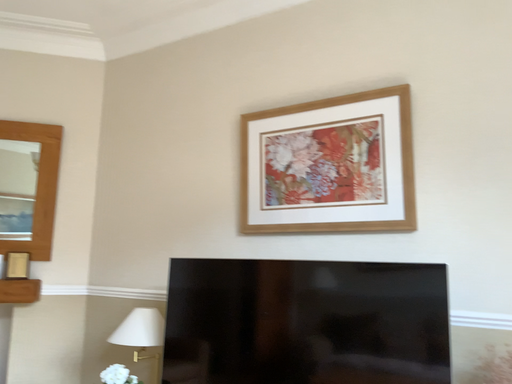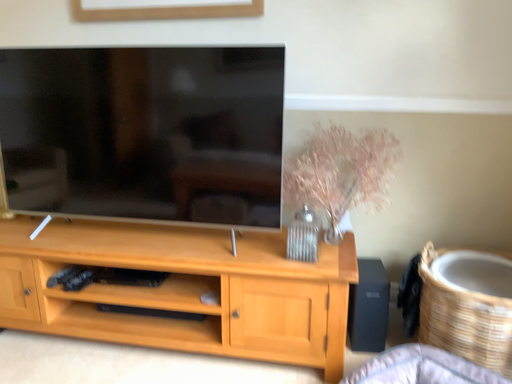
Question: Which way did the camera rotate in the video?

Choices:
 (A) rotated downward
 (B) rotated upward

Answer: (A)